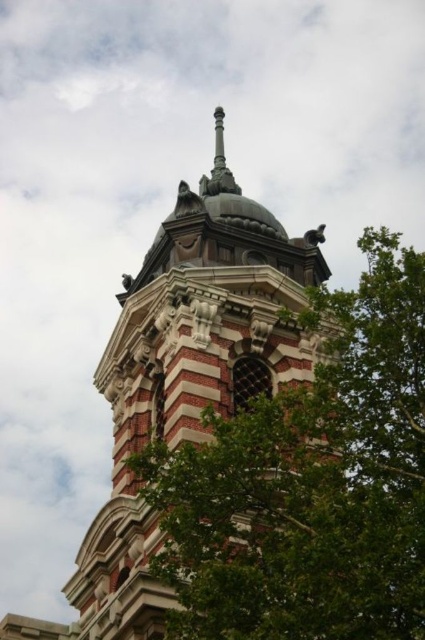
You are an architect assessing the structural integrity of the building. Given that the polished brass spire at center top is lighter than the polished stone tower at center, which part of the building would you expect to withstand stronger winds? Please base your answer on their sizes and materials.

The polished stone tower at center has a larger size and is made of heavier material compared to the polished brass spire at center top, so it would withstand stronger winds better.

You are standing at the base of the historic building and want to take a photo of the point at coordinates point (408, 291). If your camera has a maximum zoom range of 100 feet, will you be able to capture the point clearly without moving closer?

The point (408, 291) is 156.56 feet away from the viewer. Since the camera can only zoom up to 100 feet, you will not be able to capture the point clearly without moving closer.